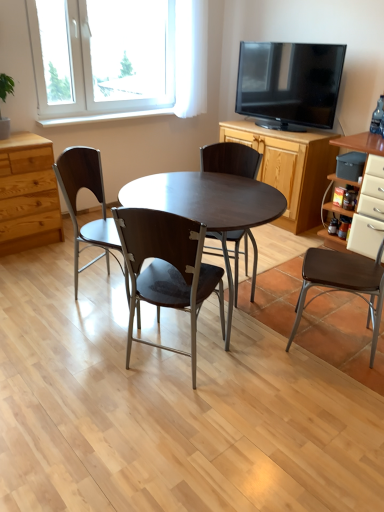
Identify the location of free area behind brown leather chair at right, the fourth chair from the left. (326, 302).